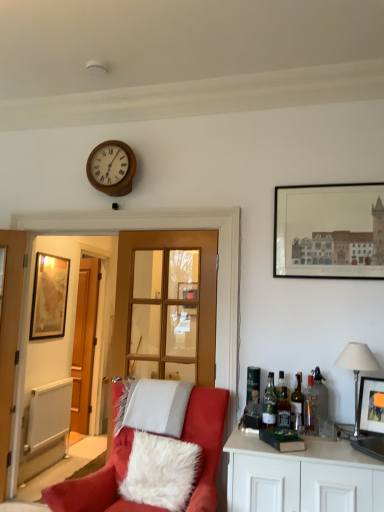
Question: Considering the relative sizes of white textured radiator at lower left and translucent glass bottle at right, which is the sixth bottle in right-to-left order, in the image provided, is white textured radiator at lower left wider than translucent glass bottle at right, which is the sixth bottle in right-to-left order,?

Choices:
 (A) no
 (B) yes

Answer: (A)

Question: Can you confirm if white textured radiator at lower left is positioned to the left of translucent glass bottle at right, which is the sixth bottle in right-to-left order?

Choices:
 (A) no
 (B) yes

Answer: (B)

Question: Is white textured radiator at lower left shorter than translucent glass bottle at right, which is the sixth bottle in right-to-left order?

Choices:
 (A) yes
 (B) no

Answer: (B)

Question: Can you confirm if white textured radiator at lower left is taller than translucent glass bottle at right, which is the sixth bottle in right-to-left order?

Choices:
 (A) yes
 (B) no

Answer: (A)

Question: Is white textured radiator at lower left closer to camera compared to translucent glass bottle at right, arranged as the first bottle when viewed from the left?

Choices:
 (A) no
 (B) yes

Answer: (A)

Question: Is white textured radiator at lower left looking in the opposite direction of translucent glass bottle at right, which is the sixth bottle in right-to-left order?

Choices:
 (A) yes
 (B) no

Answer: (B)

Question: Can you confirm if translucent glass bottle at right, the 4th bottle from the left, is taller than green glass bottle at right, the 3th bottle from the left?

Choices:
 (A) yes
 (B) no

Answer: (B)

Question: Considering the relative sizes of translucent glass bottle at right, the 4th bottle from the left, and green glass bottle at right, which is counted as the 4th bottle, starting from the right, in the image provided, is translucent glass bottle at right, the 4th bottle from the left, shorter than green glass bottle at right, which is counted as the 4th bottle, starting from the right,?

Choices:
 (A) no
 (B) yes

Answer: (B)

Question: From a real-world perspective, is translucent glass bottle at right, the 3th bottle from the right, physically below green glass bottle at right, which is counted as the 4th bottle, starting from the right?

Choices:
 (A) yes
 (B) no

Answer: (A)

Question: Considering the relative sizes of translucent glass bottle at right, the 3th bottle from the right, and green glass bottle at right, which is counted as the 4th bottle, starting from the right, in the image provided, is translucent glass bottle at right, the 3th bottle from the right, thinner than green glass bottle at right, which is counted as the 4th bottle, starting from the right,?

Choices:
 (A) no
 (B) yes

Answer: (B)

Question: Considering the relative sizes of translucent glass bottle at right, the 3th bottle from the right, and green glass bottle at right, which is counted as the 4th bottle, starting from the right, in the image provided, is translucent glass bottle at right, the 3th bottle from the right, smaller than green glass bottle at right, which is counted as the 4th bottle, starting from the right,?

Choices:
 (A) no
 (B) yes

Answer: (B)

Question: Could green glass bottle at right, which is counted as the 4th bottle, starting from the right, be considered to be inside translucent glass bottle at right, the 3th bottle from the right?

Choices:
 (A) yes
 (B) no

Answer: (B)